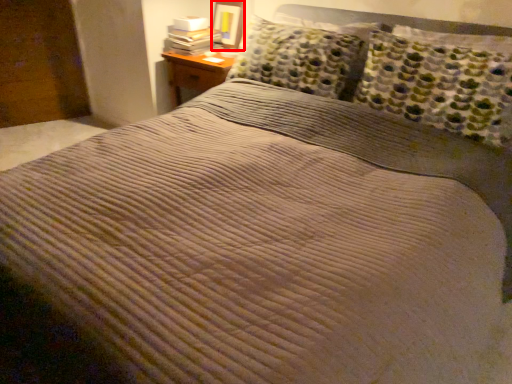
Question: From the image's perspective, what is the correct spatial relationship of picture frame (annotated by the red box) in relation to book?

Choices:
 (A) above
 (B) below

Answer: (A)